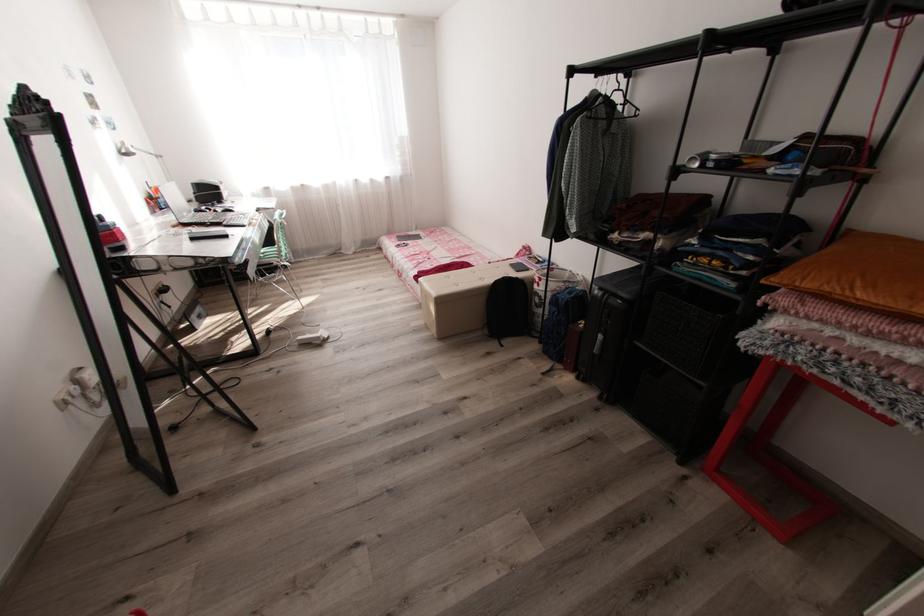
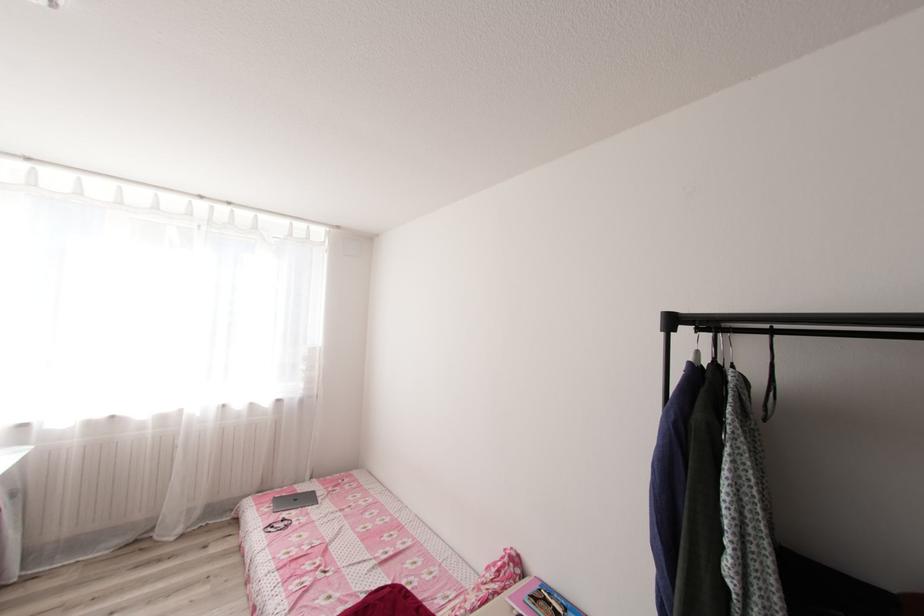
Where in the second image is the point corresponding to pixel 412 237 from the first image?

(300, 499)